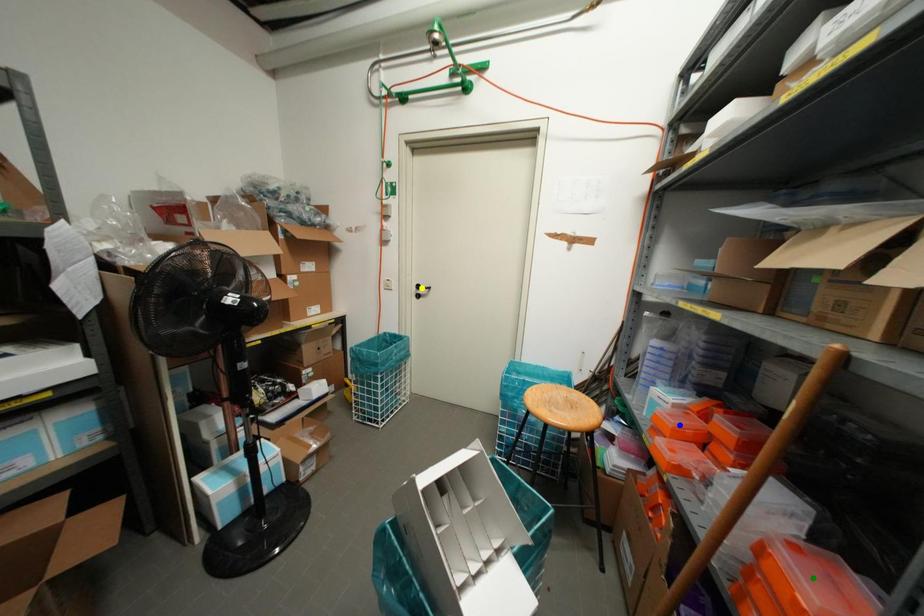
In the scene shown: Order these from nearest to farthest:
1. yellow point
2. green point
3. blue point

green point, blue point, yellow point